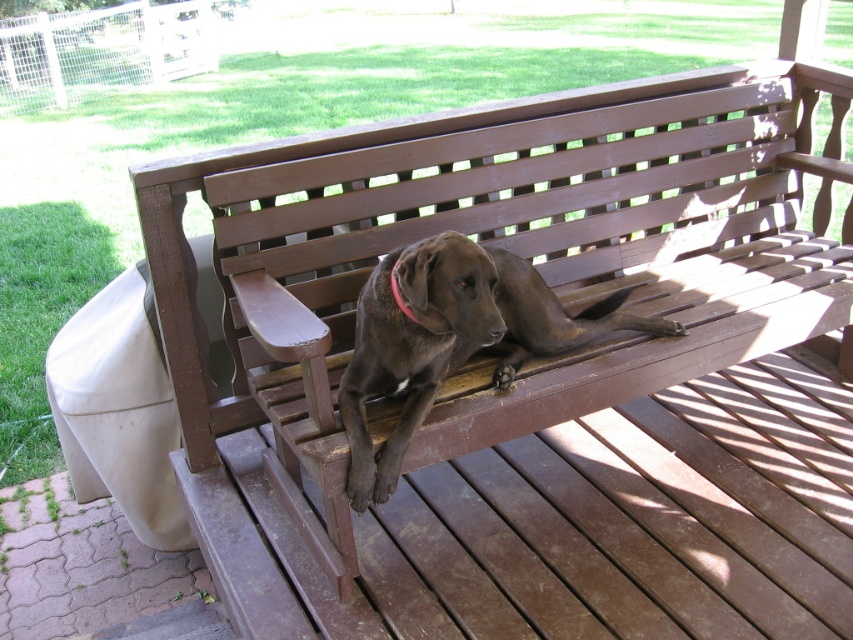
Question: Which point is closer to the camera taking this photo?

Choices:
 (A) (277, 593)
 (B) (396, 262)
 (C) (341, 412)

Answer: (C)

Question: Among these points, which one is farthest from the camera?

Choices:
 (A) (397, 301)
 (B) (650, 384)

Answer: (B)

Question: Which of these objects is positioned closest to the pink fabric neckband at center?

Choices:
 (A) brown matte dog at center
 (B) brown wooden bench at center

Answer: (A)

Question: Can you confirm if brown matte dog at center is bigger than pink fabric neckband at center?

Choices:
 (A) yes
 (B) no

Answer: (A)

Question: Observing the image, what is the correct spatial positioning of brown wooden bench at center in reference to pink fabric neckband at center?

Choices:
 (A) left
 (B) right

Answer: (B)

Question: Considering the relative positions of brown wooden bench at center and pink fabric neckband at center in the image provided, where is brown wooden bench at center located with respect to pink fabric neckband at center?

Choices:
 (A) left
 (B) right

Answer: (B)